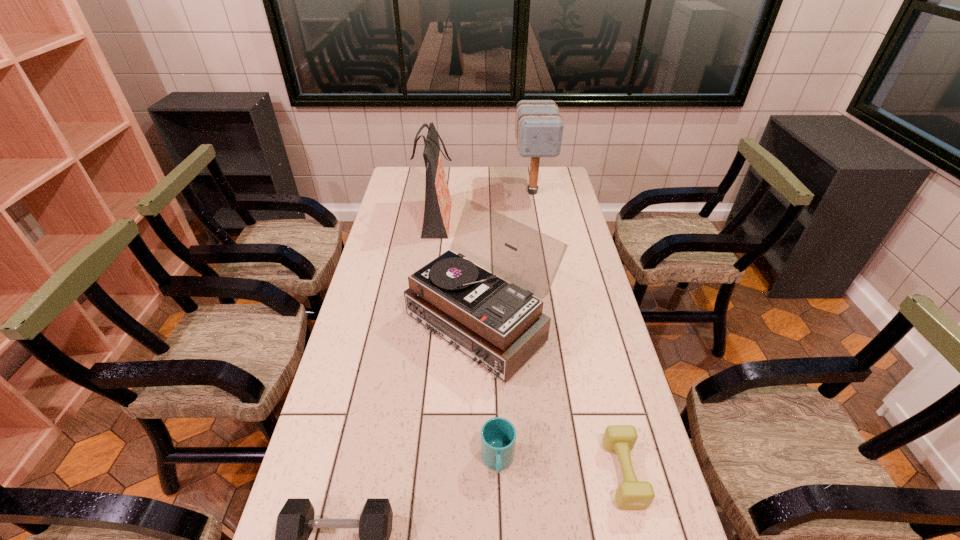
The height and width of the screenshot is (540, 960). What are the coordinates of `blank space located 0.070m on the handle side of the cup` in the screenshot? It's located at (499, 516).

You are a GUI agent. You are given a task and a screenshot of the screen. Output one action in this format:
    pyautogui.click(x=<x>, y=<y>)
    Task: Click on the vacant space located on the left of the right dumbbell
    The width and height of the screenshot is (960, 540).
    Given the screenshot: What is the action you would take?
    pyautogui.click(x=552, y=473)

Where is `object located at the far edge`? This screenshot has height=540, width=960. object located at the far edge is located at coordinates (539, 127).

The width and height of the screenshot is (960, 540). In order to click on object at the left edge in this screenshot , I will do `click(437, 210)`.

I want to click on mallet that is at the right edge, so click(539, 127).

Locate an element on the screen. This screenshot has width=960, height=540. dumbbell present at the right edge is located at coordinates (632, 494).

This screenshot has height=540, width=960. Identify the location of object that is at the far right corner. (539, 127).

In the image, there is a desktop. Identify the location of vacant space at the left edge. (378, 251).

In order to click on vacant space at the right edge of the desktop in this screenshot , I will do `click(553, 213)`.

This screenshot has height=540, width=960. Identify the location of blank area at the far left corner. (418, 170).